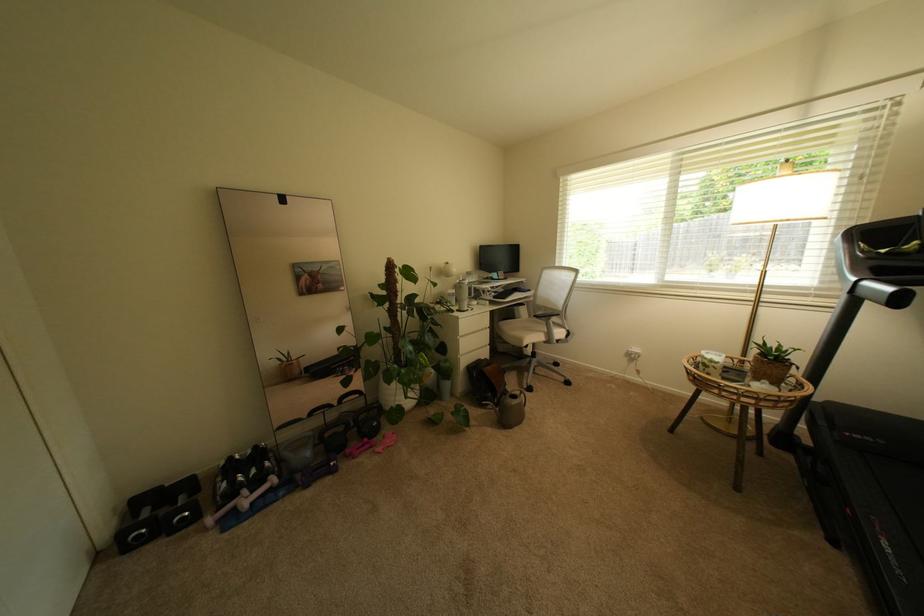
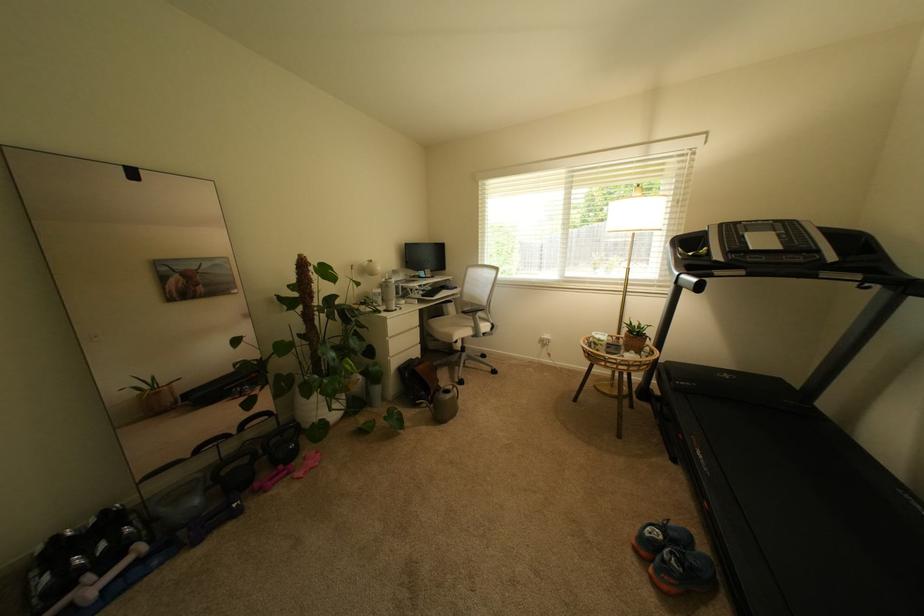
In the second image, find the point that corresponds to point 395,386 in the first image.

(312, 400)